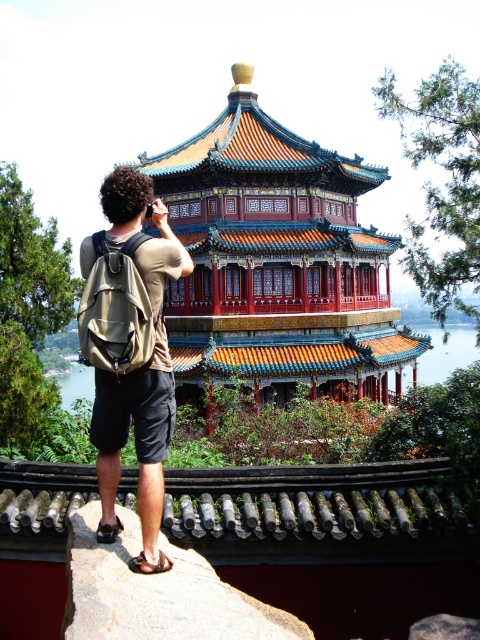
Question: Which of the following is the farthest from the observer?

Choices:
 (A) shiny lacquered pavilion at center
 (B) khaki fabric backpack at center

Answer: (A)

Question: Does shiny lacquered pavilion at center come in front of khaki fabric backpack at center?

Choices:
 (A) yes
 (B) no

Answer: (B)

Question: Does shiny lacquered pavilion at center lie in front of khaki fabric backpack at center?

Choices:
 (A) no
 (B) yes

Answer: (A)

Question: Does shiny lacquered pavilion at center appear on the right side of khaki fabric backpack at center?

Choices:
 (A) yes
 (B) no

Answer: (A)